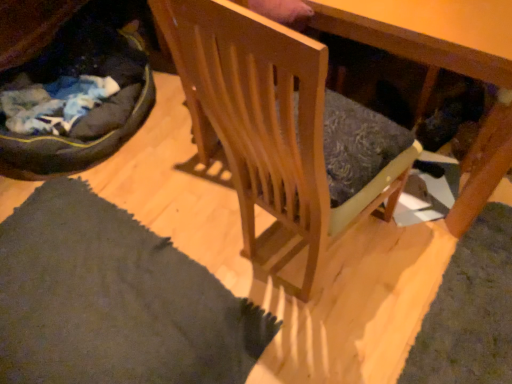
Question: Should I look upward or downward to see wooden chair at center?

Choices:
 (A) up
 (B) down

Answer: (A)

Question: From a real-world perspective, does dark gray fabric cat bed at lower left sit lower than wooden chair at center?

Choices:
 (A) yes
 (B) no

Answer: (A)

Question: Can you see dark gray fabric cat bed at lower left touching wooden chair at center?

Choices:
 (A) no
 (B) yes

Answer: (A)

Question: Considering the relative sizes of dark gray fabric cat bed at lower left and wooden chair at center in the image provided, is dark gray fabric cat bed at lower left smaller than wooden chair at center?

Choices:
 (A) no
 (B) yes

Answer: (A)

Question: Considering the relative sizes of dark gray fabric cat bed at lower left and wooden chair at center in the image provided, is dark gray fabric cat bed at lower left thinner than wooden chair at center?

Choices:
 (A) yes
 (B) no

Answer: (B)

Question: Is dark gray fabric cat bed at lower left positioned behind wooden chair at center?

Choices:
 (A) no
 (B) yes

Answer: (B)

Question: From the image's perspective, does dark gray fabric cat bed at lower left appear lower than wooden chair at center?

Choices:
 (A) no
 (B) yes

Answer: (A)

Question: Considering the relative sizes of wooden chair at center and dark gray fabric cat bed at lower left in the image provided, is wooden chair at center bigger than dark gray fabric cat bed at lower left?

Choices:
 (A) yes
 (B) no

Answer: (B)

Question: Can you confirm if wooden chair at center is thinner than dark gray fabric cat bed at lower left?

Choices:
 (A) no
 (B) yes

Answer: (B)

Question: Is wooden chair at center further to the viewer compared to dark gray fabric cat bed at lower left?

Choices:
 (A) no
 (B) yes

Answer: (A)

Question: From a real-world perspective, is wooden chair at center positioned over dark gray fabric cat bed at lower left based on gravity?

Choices:
 (A) yes
 (B) no

Answer: (A)

Question: Are wooden chair at center and dark gray fabric cat bed at lower left beside each other?

Choices:
 (A) yes
 (B) no

Answer: (B)

Question: Is dark gray fabric cat bed at lower left at the back of wooden chair at center?

Choices:
 (A) no
 (B) yes

Answer: (A)

Question: From the image's perspective, relative to wooden chair at center, is dark gray fabric cat bed at lower left above or below?

Choices:
 (A) above
 (B) below

Answer: (A)